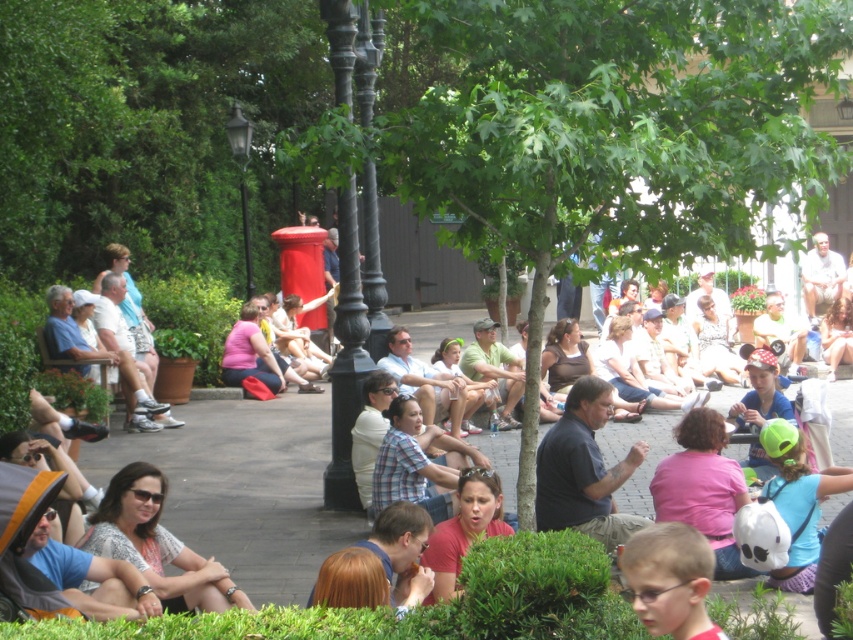
The width and height of the screenshot is (853, 640). What do you see at coordinates (155, 544) in the screenshot?
I see `patterned fabric shirt at center` at bounding box center [155, 544].

Does patterned fabric shirt at center have a lesser height compared to light brown fabric pants at center?

Indeed, patterned fabric shirt at center has a lesser height compared to light brown fabric pants at center.

The image size is (853, 640). I want to click on patterned fabric shirt at center, so click(155, 544).

Does green leafy tree at center appear on the right side of light brown fabric pants at center?

In fact, green leafy tree at center is to the left of light brown fabric pants at center.

Who is positioned more to the right, green leafy tree at center or light brown fabric pants at center?

Positioned to the right is light brown fabric pants at center.

Who is more distant from viewer, (543, 256) or (811, 304)?

Positioned behind is point (811, 304).

Locate an element on the screen. green leafy tree at center is located at coordinates (607, 129).

Which is in front, point (517, 182) or point (161, 532)?

Point (517, 182) is in front.

Does green leafy tree at center come in front of patterned fabric shirt at center?

Yes.

Is point (454, 240) positioned before point (196, 602)?

No, it is behind (196, 602).

The image size is (853, 640). I want to click on green leafy tree at center, so click(x=607, y=129).